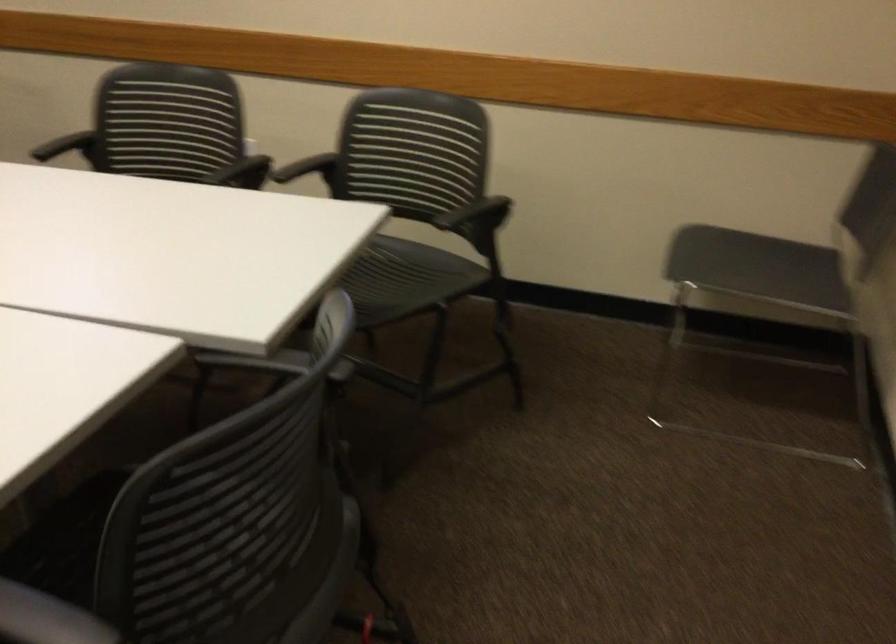
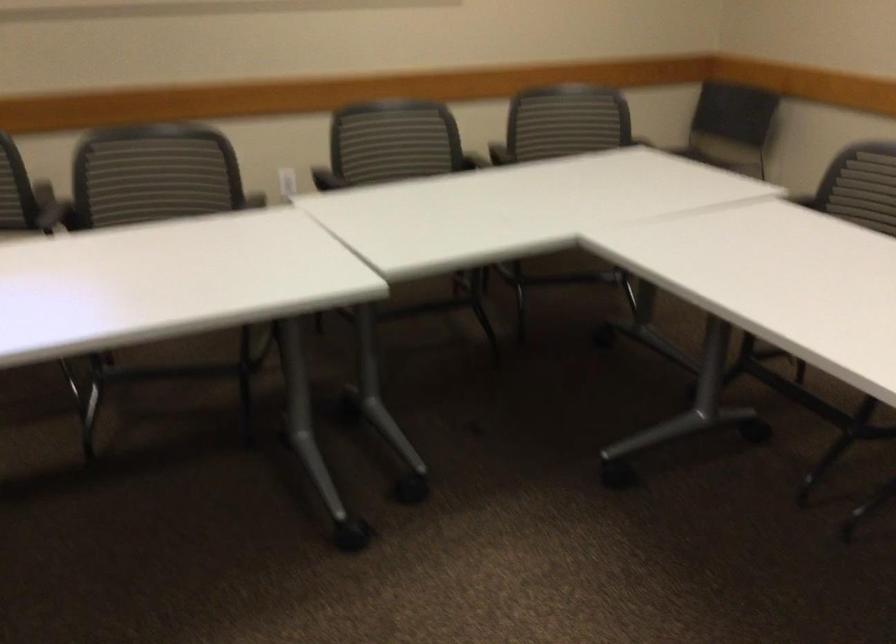
Where in the second image is the point corresponding to (309,388) from the first image?

(866, 185)